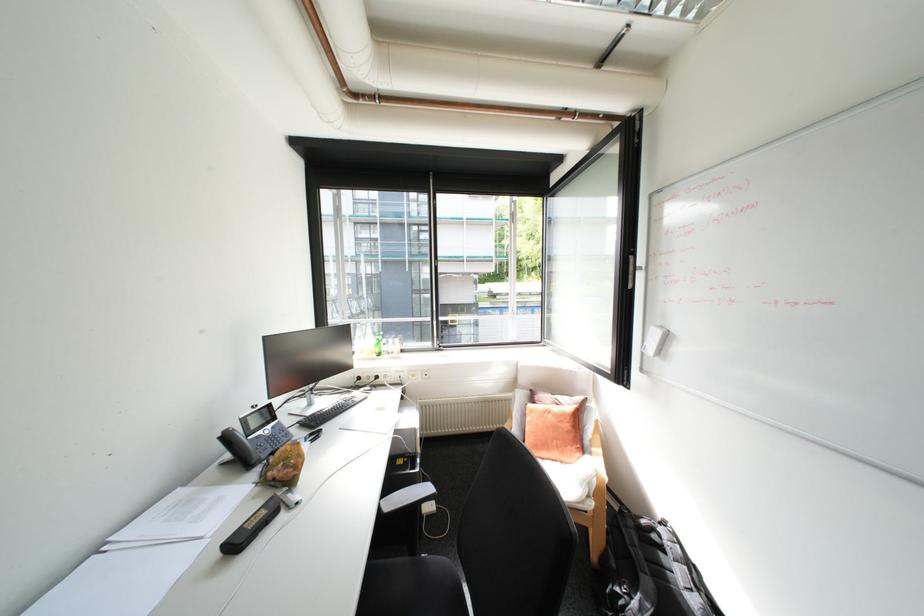
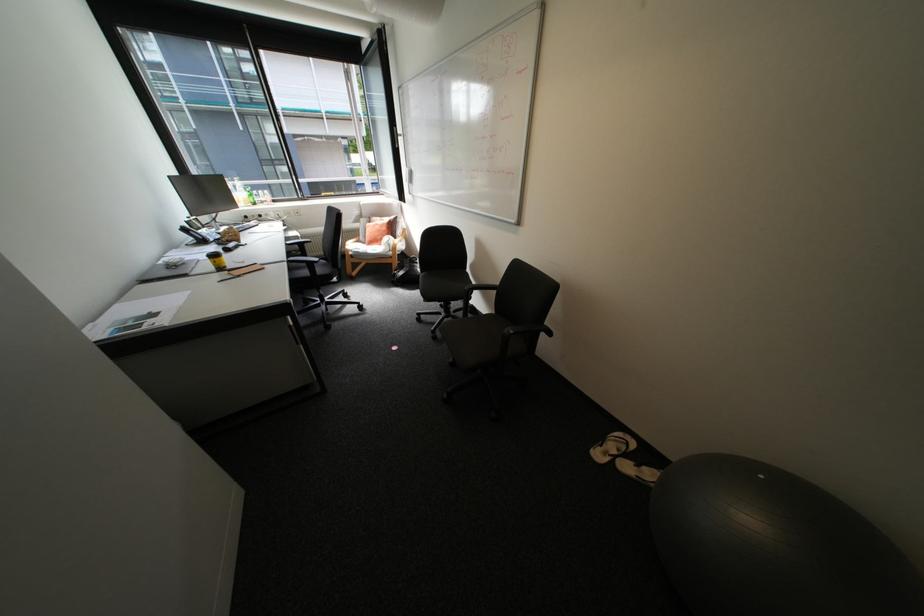
Locate, in the second image, the point that corresponds to point 388,512 in the first image.

(296, 244)